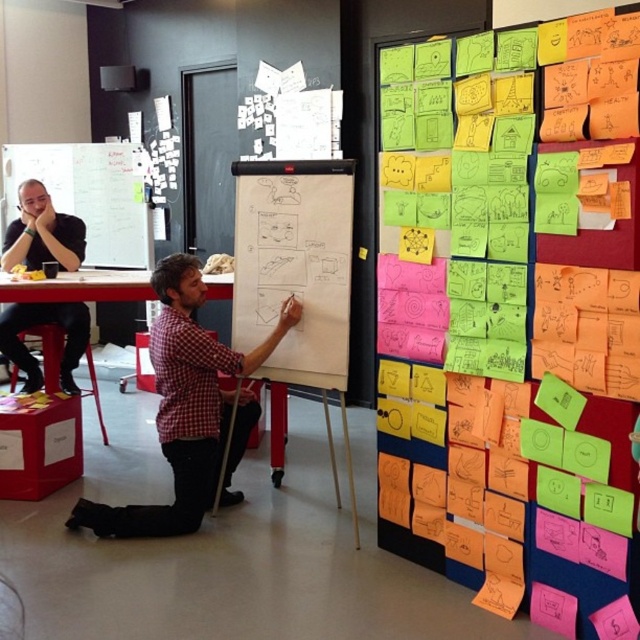
You are a person sitting on the red plastic stool at lower left and want to reach the white paperboard at center to write something. Can you comfortably reach it without moving your stool?

The white paperboard at center is 5.97 feet from the red plastic stool at lower left. Since 5.97 feet is approximately 71.64 inches, which is beyond the typical comfortable reaching distance of around 29 to 35 inches, you would likely need to move closer to comfortably reach the white paperboard at center while sitting on the red plastic stool at lower left.

You are standing in the collaborative workspace and want to reach the point at coordinates point (176, 326). If you can stretch your arm 8 feet, can you reach it?

The point (176, 326) is 10.28 feet away from viewer, so no, you cannot reach it with an arm stretch of 8 feet.